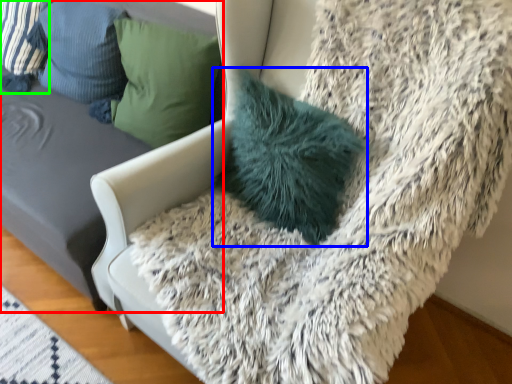
Question: Based on their relative distances, which object is nearer to furniture (highlighted by a red box)? Choose from pillow (highlighted by a blue box) and pillow (highlighted by a green box).

Choices:
 (A) pillow
 (B) pillow

Answer: (B)